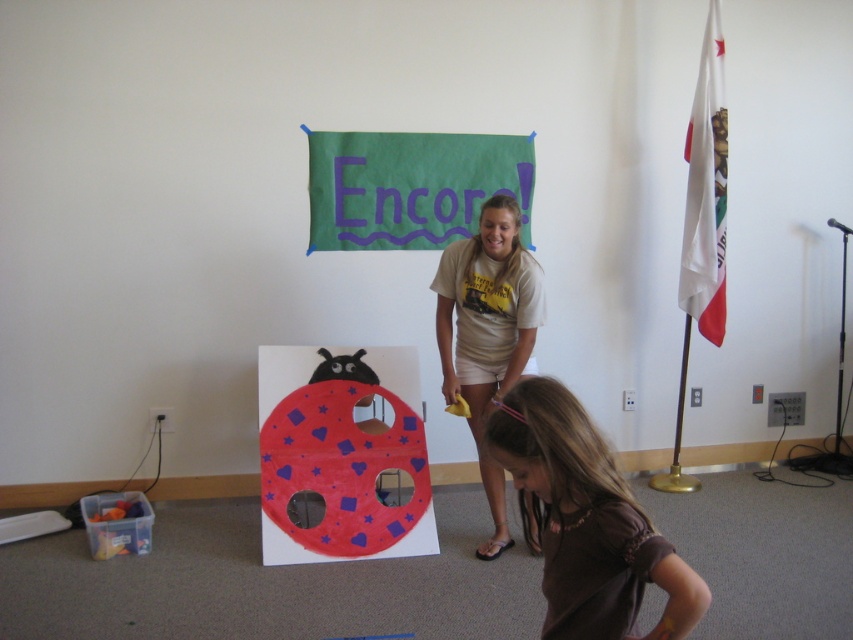
Can you confirm if brown cotton shirt at lower center is bigger than beige cotton t-shirt at center?

No, brown cotton shirt at lower center is not bigger than beige cotton t-shirt at center.

Between brown cotton shirt at lower center and beige cotton t-shirt at center, which one appears on the left side from the viewer's perspective?

From the viewer's perspective, beige cotton t-shirt at center appears more on the left side.

At what (x,y) coordinates should I click in order to perform the action: click on brown cotton shirt at lower center. Please return your answer as a coordinate pair (x, y). This screenshot has height=640, width=853. Looking at the image, I should click on (585, 522).

Locate an element on the screen. brown cotton shirt at lower center is located at coordinates (585, 522).